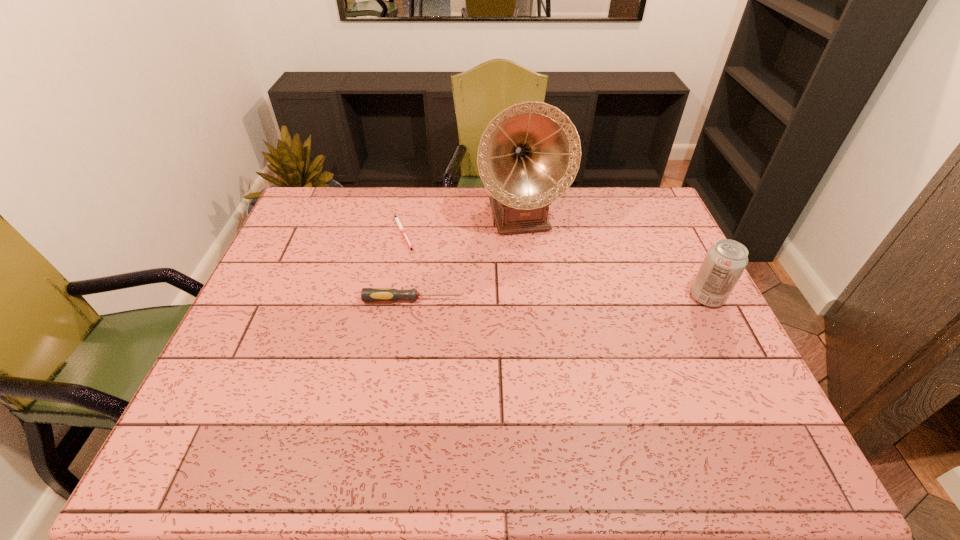
I want to click on free space between the rightmost object and the third tallest object, so click(561, 299).

Point out which object is positioned as the second nearest to the pen. Please provide its 2D coordinates. Your answer should be formatted as a tuple, i.e. [(x, y)], where the tuple contains the x and y coordinates of a point satisfying the conditions above.

[(528, 156)]

Identify the location of the third closest object to the screwdriver. Image resolution: width=960 pixels, height=540 pixels. tap(725, 261).

Where is `free space that satisfies the following two spatial constraints: 1. on the front side of the phonograph record; 2. on the right side of the soda can`? Image resolution: width=960 pixels, height=540 pixels. free space that satisfies the following two spatial constraints: 1. on the front side of the phonograph record; 2. on the right side of the soda can is located at coordinates (531, 297).